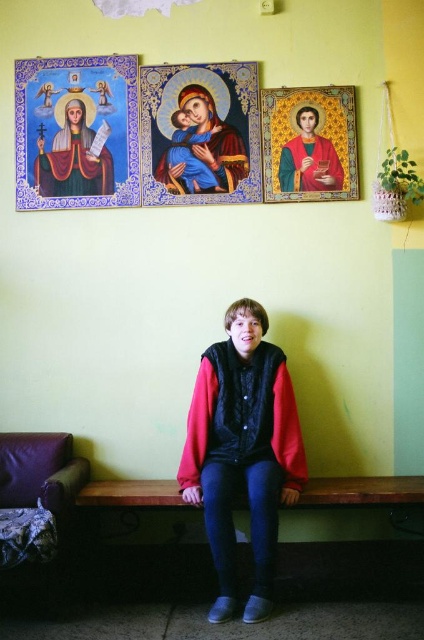
What are the coordinates of the matte gold icon at upper left?

The coordinates of the matte gold icon at upper left are at point (72, 160).

In the scene shown: You are standing in front of the wall with the religious icon paintings. You notice two points marked on the wall at coordinates point (190,96) and point (286,177). If you want to touch both points starting from the one closer to you, which point should you touch first?

You should touch point (190,96) first because it is closer to you than point (286,177).

You are an art conservator examining the religious icons on the wall. You need to clean the matte gold icon at upper left and the gold textured icon at upper center. Which icon should you clean first if you want to start with the one that is closer to you?

You should clean the matte gold icon at upper left first because it is closer to you than the gold textured icon at upper center.